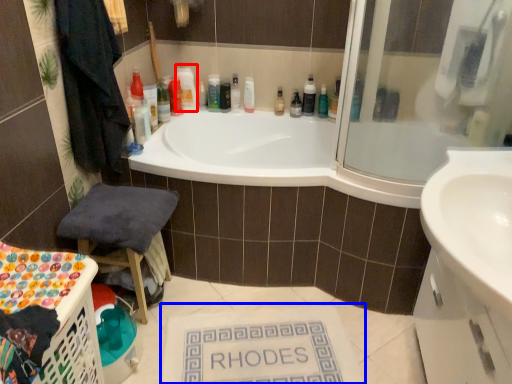
Question: Which object is further to the camera taking this photo, cleaning product (highlighted by a red box) or bath mat (highlighted by a blue box)?

Choices:
 (A) cleaning product
 (B) bath mat

Answer: (A)